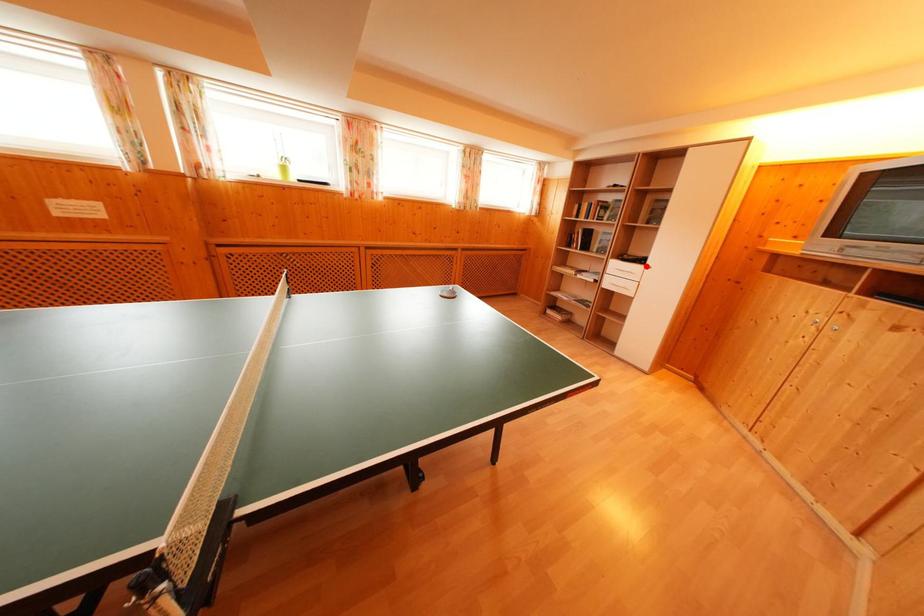
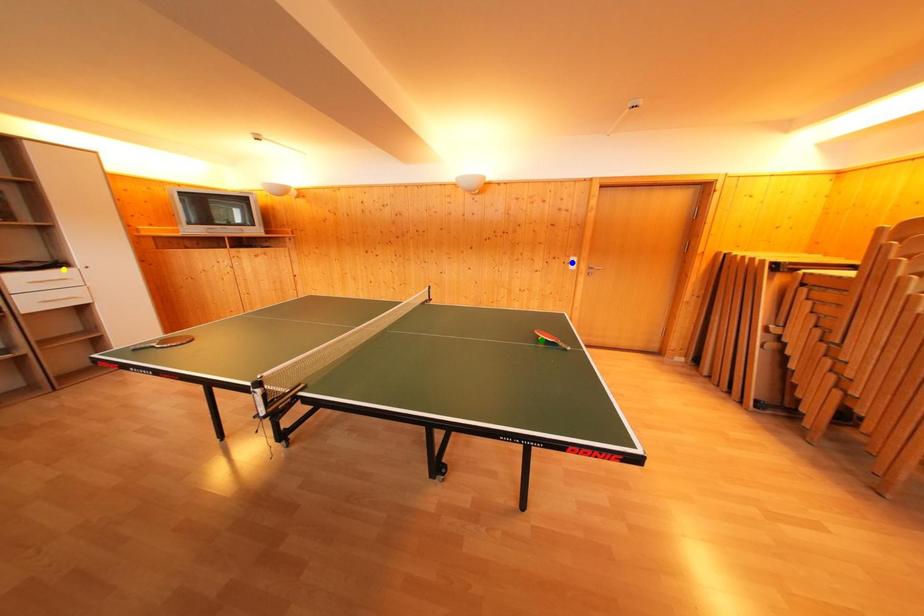
Question: I am providing you with two images of the same scene from different viewpoints. A red point is marked on the first image. You are given multiple points on the second image. Which point in image 2 is actually the same real-world point as the red point in image 1?

Choices:
 (A) green point
 (B) yellow point
 (C) blue point

Answer: (B)